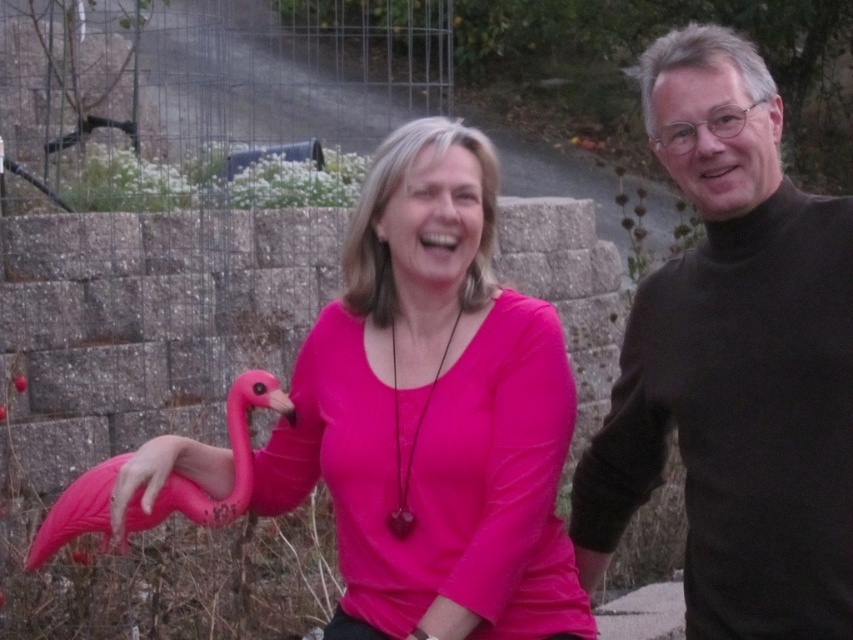
Which is behind, point (468, 550) or point (625, 378)?

Positioned behind is point (625, 378).

Between point (299, 490) and point (675, 326), which one is positioned behind?

Positioned behind is point (299, 490).

In order to click on pink matte plastic flamingo at center in this screenshot , I will do `click(433, 413)`.

Looking at this image, is pink matte plastic flamingo at center taller than pink plastic flamingo at lower left?

Correct, pink matte plastic flamingo at center is much taller as pink plastic flamingo at lower left.

Does point (467, 548) come closer to viewer compared to point (62, 497)?

Yes, it is.

Is point (402, 428) closer to viewer compared to point (236, 435)?

Yes, point (402, 428) is closer to viewer.

I want to click on pink matte plastic flamingo at center, so click(433, 413).

Can you confirm if black turtleneck sweater at right is positioned below pink plastic flamingo at lower left?

No.

Does black turtleneck sweater at right appear over pink plastic flamingo at lower left?

Yes.

Find the location of a particular element. The image size is (853, 640). black turtleneck sweater at right is located at coordinates (734, 364).